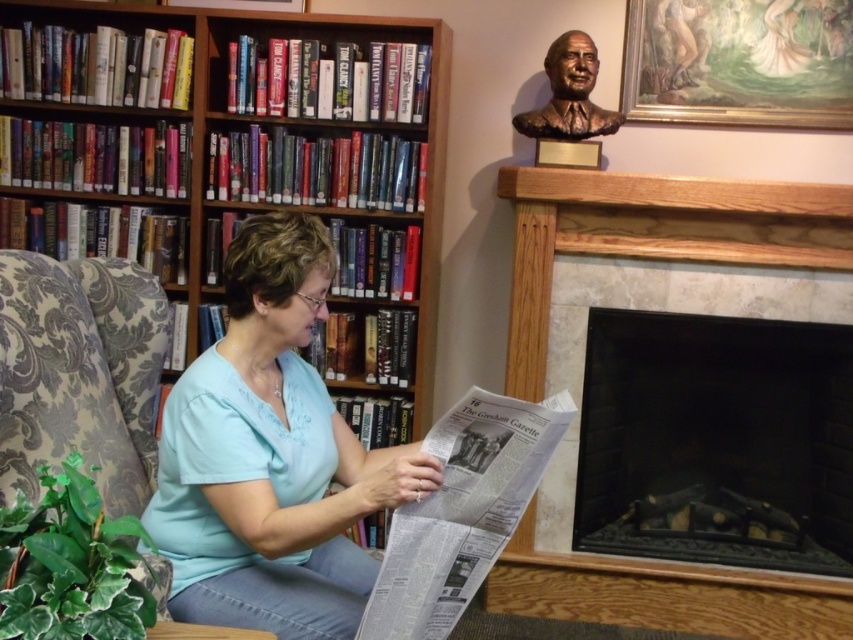
You are standing in the living room and want to take a photo of the two points mentioned. Which point, point (x=247, y=380) or point (x=576, y=38), will appear larger in your camera view?

Point (x=247, y=380) will appear larger in the camera view because it is closer to the camera than point (x=576, y=38).

You are an interior designer planning to place a new lamp between the light blue fabric shirt at center and the bronze bust at upper right. Which object should the lamp be placed closer to, based on their heights?

The light blue fabric shirt at center is taller than the bronze bust at upper right, so the lamp should be placed closer to the bronze bust at upper right to balance the height difference.